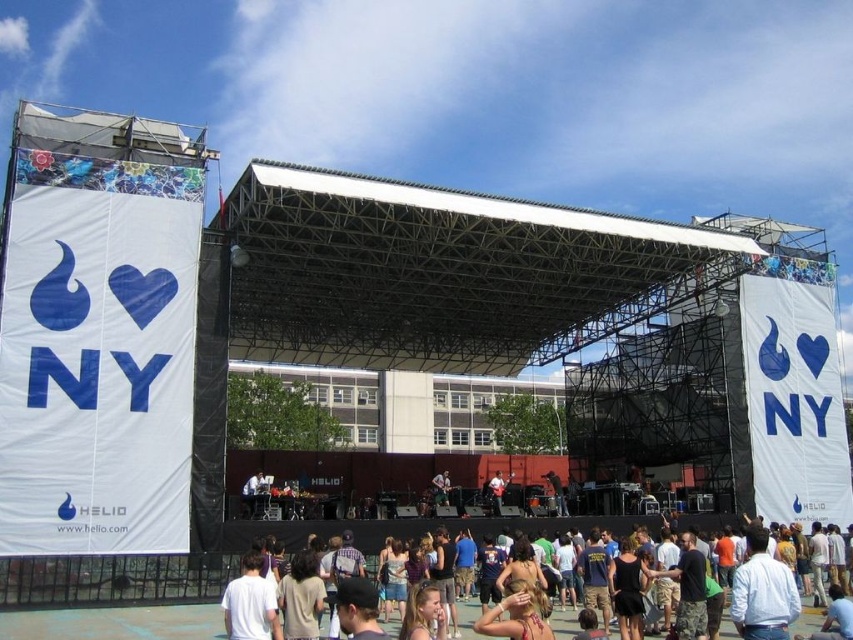
You are a photographer standing in front of the stage at the outdoor concert. You want to capture a photo of both the shiny black guitar at center and the white fabric shirt at center. Which object should you focus on first to ensure it appears sharp in the foreground?

The shiny black guitar at center is further to the viewer than the white fabric shirt at center, so you should focus on the shiny black guitar at center first to ensure it appears sharp in the foreground.

You are a photographer at the concert, and you want to capture both the shiny black guitar at center and the white fabric shirt at center in a single frame. Which object will appear smaller in the photo?

The shiny black guitar at center will appear smaller in the photo because it has a smaller size compared to the white fabric shirt at center.